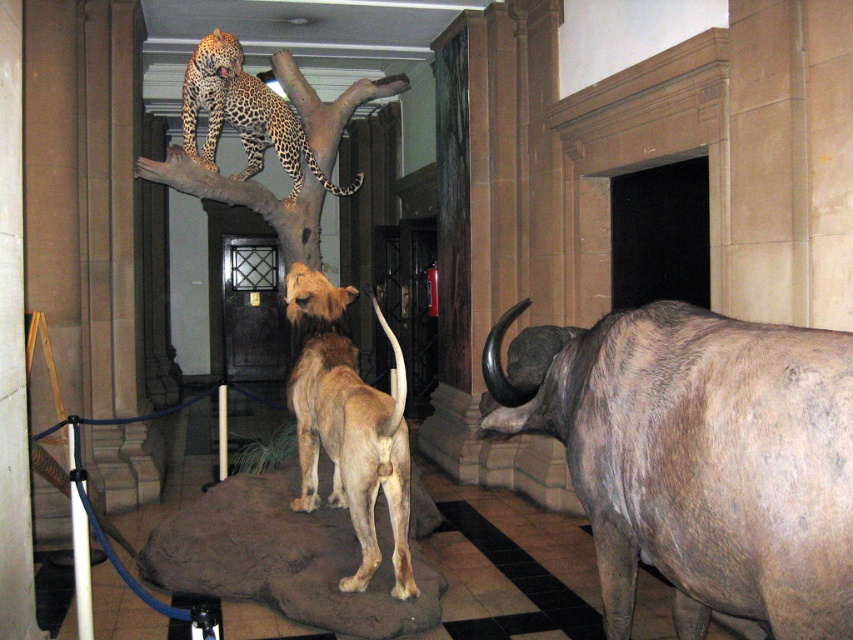
Question: Which of the following is the farthest from the observer?

Choices:
 (A) golden-brown fur lion at center
 (B) spotted fur leopard at upper center

Answer: (B)

Question: Considering the real-world distances, which object is closest to the grayish-brown textured buffalo at right?

Choices:
 (A) golden-brown fur lion at center
 (B) spotted fur leopard at upper center

Answer: (A)

Question: Does grayish-brown textured buffalo at right appear under golden-brown fur lion at center?

Choices:
 (A) no
 (B) yes

Answer: (B)

Question: Does grayish-brown textured buffalo at right lie behind golden-brown fur lion at center?

Choices:
 (A) yes
 (B) no

Answer: (B)

Question: Which point is closer to the camera taking this photo?

Choices:
 (A) (352, 492)
 (B) (663, 449)
 (C) (273, 144)

Answer: (B)

Question: Does grayish-brown textured buffalo at right come behind golden-brown fur lion at center?

Choices:
 (A) yes
 (B) no

Answer: (B)